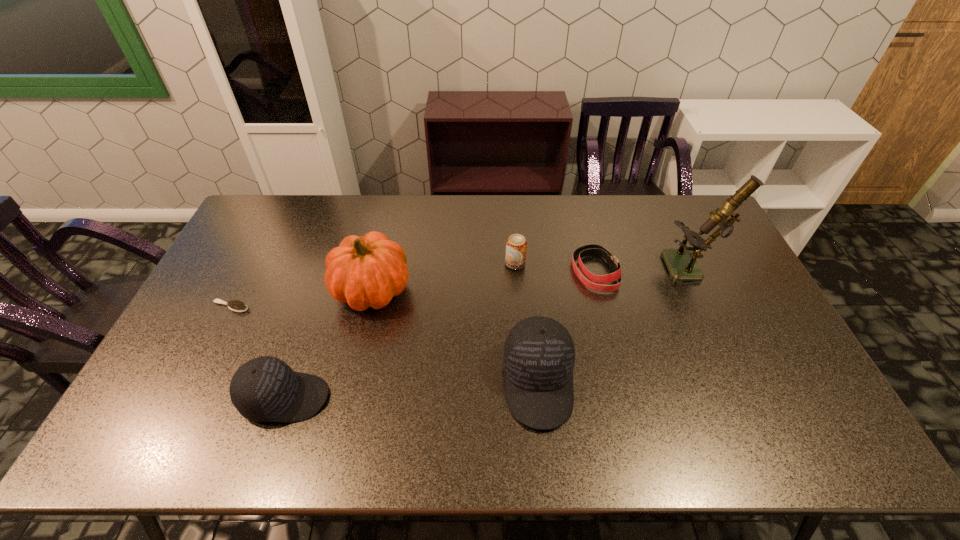
Given the evenly spaced baseball caps in the image, where should an extra baseball cap be added on the right to preserve the spacing? Please point to a vacant space. Please provide its 2D coordinates. Your answer should be formatted as a tuple, i.e. [(x, y)], where the tuple contains the x and y coordinates of a point satisfying the conditions above.

[(778, 366)]